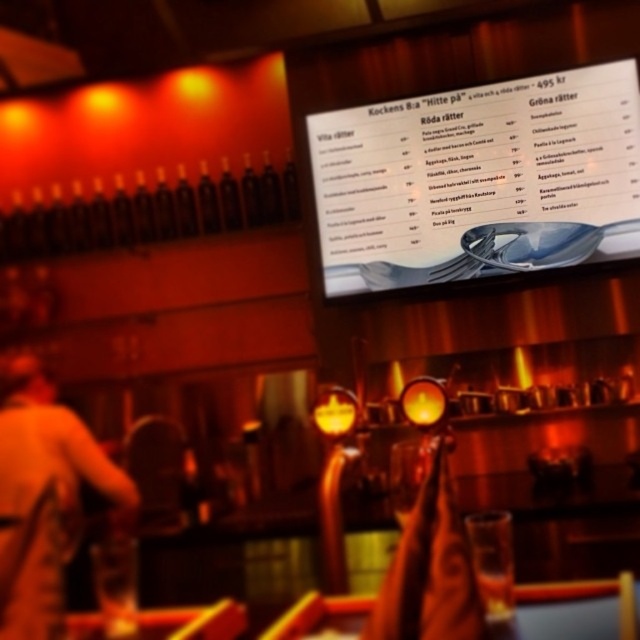
You are a customer in the restaurant and want to read the menu. The white glossy menu at center is obstructed by your companion wearing the light brown leather jacket at lower left. Can you still read the menu without moving the jacket?

The white glossy menu at center is wider than the light brown leather jacket at lower left, so you can read the menu without moving the jacket because part of the menu remains visible beyond the jacket.

You are a customer in the restaurant and want to read the menu without moving the light brown leather jacket at lower left. Can you see the white glossy menu at center clearly?

The white glossy menu at center is positioned over light brown leather jacket at lower left, so yes, you can see the white glossy menu at center clearly without moving the jacket.

From the picture: You are a customer in the restaurant and want to read the white glossy menu at center. Can you walk closer to it to read the text clearly?

The white glossy menu at center is 8.69 feet away from you. Since this distance is relatively far, walking closer would allow you to read the text more clearly.